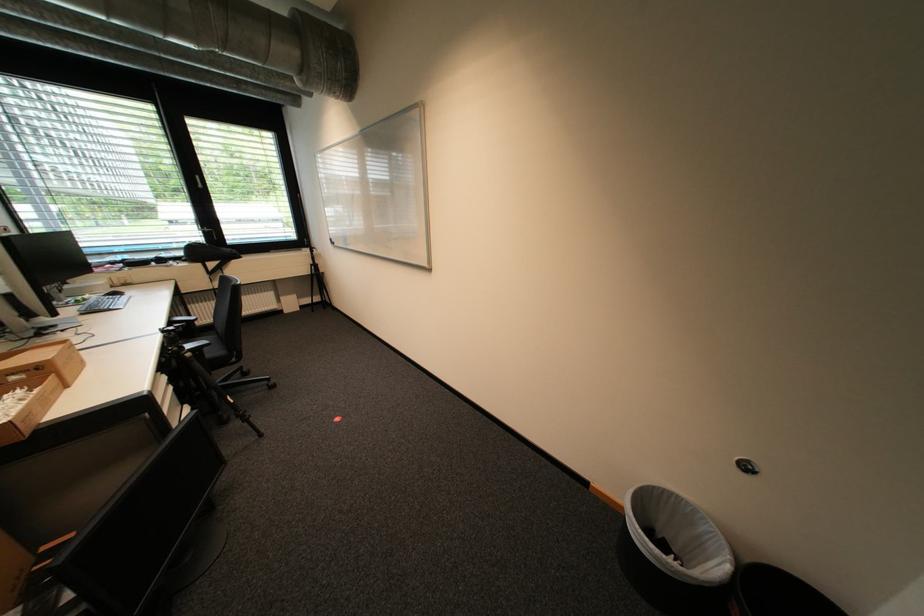
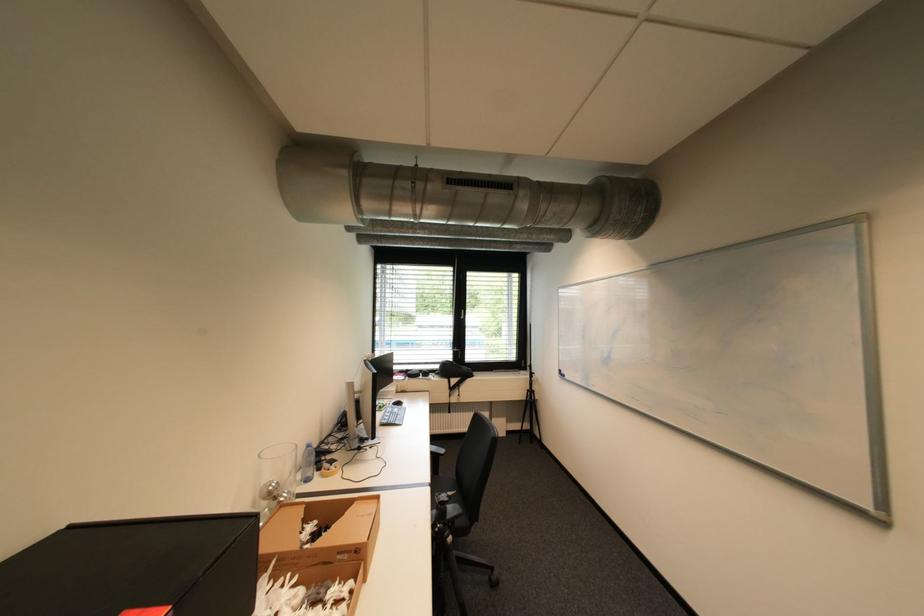
The point at (207, 177) is marked in the first image. Where is the corresponding point in the second image?

(470, 312)